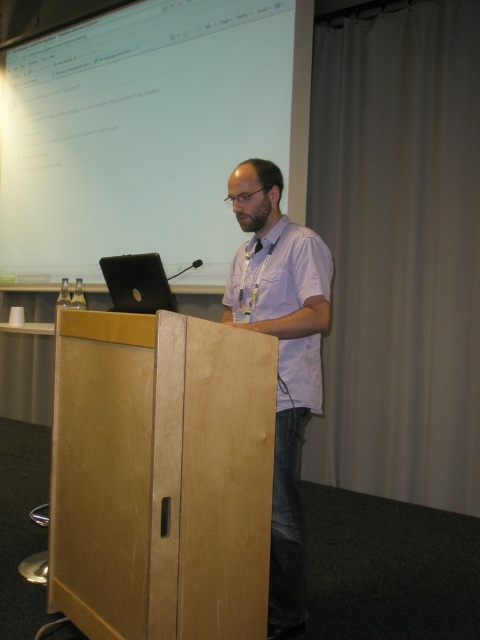
You are sitting in the audience and want to look at both the presenter and the slides. Which object should you look at first if you want to see the white glossy projection screen at upper center before the white shirt at center?

You should look at the white glossy projection screen at upper center first because it is to the left of the white shirt at center.

You are an event organizer and need to ensure the presenter is wearing the correct attire. The presenter has two shirts available for the event. The white shirt at center and the white cotton shirt at center. According to the image, which shirt is positioned to the left of the other?

The white shirt at center is positioned on the left side of white cotton shirt at center.